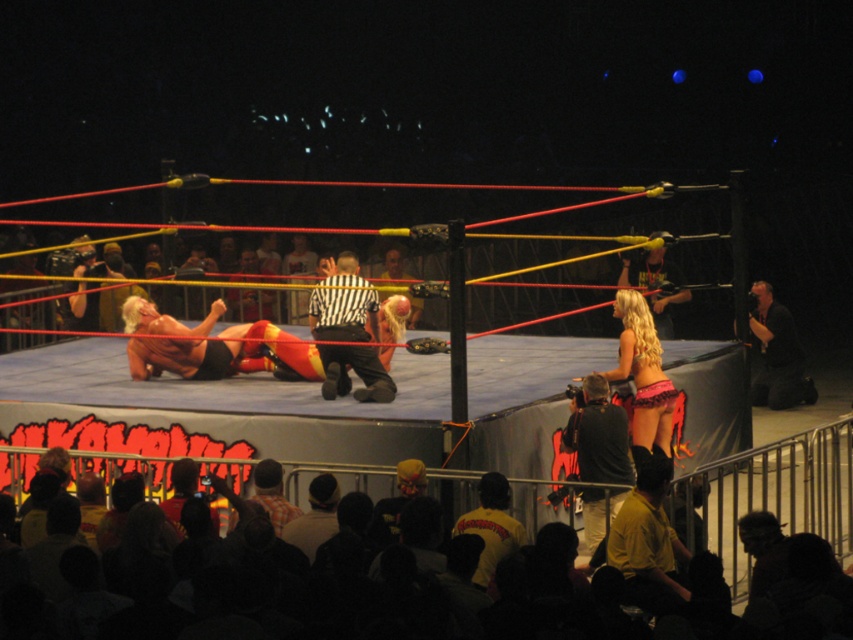
Can you confirm if yellow shirt at lower right is thinner than shiny black leather jacket at upper right?

Yes, yellow shirt at lower right is thinner than shiny black leather jacket at upper right.

Is point (643, 465) positioned before point (675, 266)?

Yes, point (643, 465) is in front of point (675, 266).

Locate an element on the screen. The width and height of the screenshot is (853, 640). yellow shirt at lower right is located at coordinates (647, 540).

The image size is (853, 640). Describe the element at coordinates (647, 540) in the screenshot. I see `yellow shirt at lower right` at that location.

Does yellow shirt at lower right have a larger size compared to black leather jacket at upper right?

No.

What do you see at coordinates (647, 540) in the screenshot? The height and width of the screenshot is (640, 853). I see `yellow shirt at lower right` at bounding box center [647, 540].

Where is `yellow shirt at lower right`? yellow shirt at lower right is located at coordinates (647, 540).

Which is behind, point (608, 477) or point (781, 317)?

The point (781, 317) is behind.

At what (x,y) coordinates should I click in order to perform the action: click on black leather camera at lower right. Please return your answer as a coordinate pair (x, y). Image resolution: width=853 pixels, height=640 pixels. Looking at the image, I should click on (598, 435).